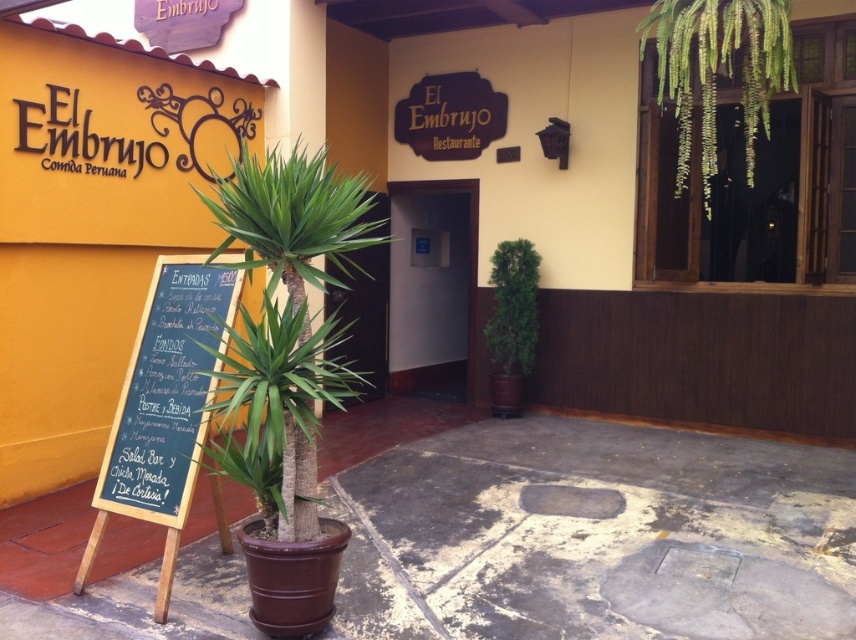
Question: Is green leafy palm tree at center to the right of green leafy plant at upper right from the viewer's perspective?

Choices:
 (A) yes
 (B) no

Answer: (B)

Question: Which of these objects is positioned farthest from the white glossy door at center?

Choices:
 (A) green leafy plant at center
 (B) black chalkboard at left
 (C) green leafy plant at upper right
 (D) green leafy palm tree at center

Answer: (B)

Question: Can you confirm if green leafy palm tree at center is positioned below green leafy plant at center?

Choices:
 (A) yes
 (B) no

Answer: (A)

Question: Based on their relative distances, which object is nearer to the green leafy palm tree at center?

Choices:
 (A) white glossy door at center
 (B) green leafy plant at upper right

Answer: (B)

Question: Is black chalkboard at left bigger than green leafy plant at upper right?

Choices:
 (A) yes
 (B) no

Answer: (B)

Question: Which of the following is the closest to the observer?

Choices:
 (A) (286, 256)
 (B) (770, 90)

Answer: (A)